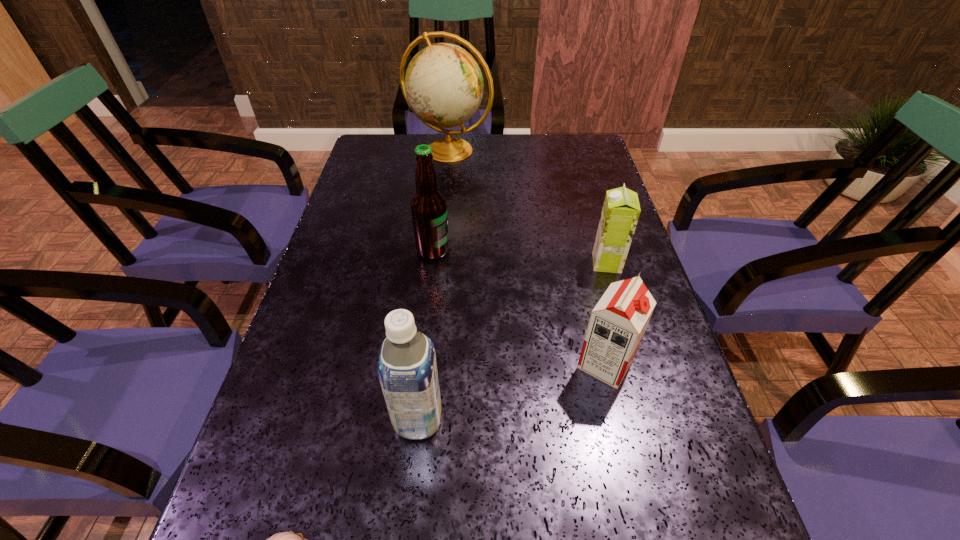
Identify the location of vacant space located 0.300m on the back of the fourth farthest object. Image resolution: width=960 pixels, height=540 pixels. (578, 245).

The height and width of the screenshot is (540, 960). What are the coordinates of `vacant space situated 0.100m on the left of the farthest soya milk` in the screenshot? It's located at (551, 263).

Identify the location of object positioned at the far edge. (443, 86).

This screenshot has width=960, height=540. Find the location of `object present at the left edge`. object present at the left edge is located at coordinates (443, 86).

The height and width of the screenshot is (540, 960). Identify the location of object that is at the far left corner. (443, 86).

This screenshot has width=960, height=540. In the image, there is a desktop. Find the location of `vacant space at the far edge`. vacant space at the far edge is located at coordinates (471, 147).

This screenshot has width=960, height=540. In the image, there is a desktop. In order to click on free region at the left edge in this screenshot , I will do `click(370, 227)`.

At what (x,y) coordinates should I click in order to perform the action: click on vacant space at the right edge. Please return your answer as a coordinate pair (x, y). Looking at the image, I should click on (704, 495).

The height and width of the screenshot is (540, 960). I want to click on free space between the farthest soya milk and the beer bottle, so click(519, 256).

At what (x,y) coordinates should I click in order to perform the action: click on empty space between the globe and the farthest soya milk. Please return your answer as a coordinate pair (x, y). Looking at the image, I should click on (528, 206).